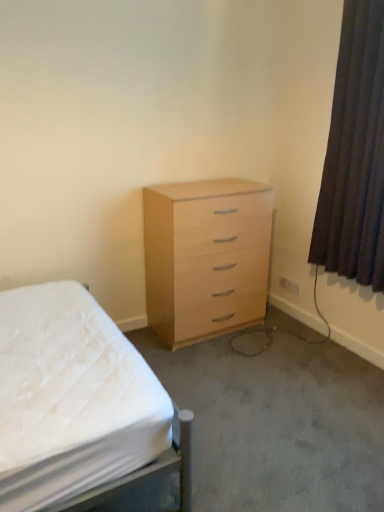
Question: From the image's perspective, is light wood/veneer chest of drawers at center under dark brown fabric curtain at right?

Choices:
 (A) yes
 (B) no

Answer: (A)

Question: Does light wood/veneer chest of drawers at center turn towards dark brown fabric curtain at right?

Choices:
 (A) yes
 (B) no

Answer: (B)

Question: Is light wood/veneer chest of drawers at center positioned in front of dark brown fabric curtain at right?

Choices:
 (A) yes
 (B) no

Answer: (B)

Question: From a real-world perspective, does light wood/veneer chest of drawers at center stand above dark brown fabric curtain at right?

Choices:
 (A) no
 (B) yes

Answer: (A)

Question: Can you confirm if light wood/veneer chest of drawers at center is positioned to the right of dark brown fabric curtain at right?

Choices:
 (A) yes
 (B) no

Answer: (B)

Question: From the image's perspective, is light wood/veneer chest of drawers at center positioned above or below dark brown fabric curtain at right?

Choices:
 (A) above
 (B) below

Answer: (B)

Question: In the image, is light wood/veneer chest of drawers at center on the left side or the right side of dark brown fabric curtain at right?

Choices:
 (A) right
 (B) left

Answer: (B)

Question: Is light wood/veneer chest of drawers at center inside or outside of dark brown fabric curtain at right?

Choices:
 (A) inside
 (B) outside

Answer: (B)

Question: Looking at the image, does light wood/veneer chest of drawers at center seem bigger or smaller compared to dark brown fabric curtain at right?

Choices:
 (A) big
 (B) small

Answer: (A)

Question: In terms of size, does light wood/veneer chest of drawers at center appear bigger or smaller than white fabric bed at center?

Choices:
 (A) big
 (B) small

Answer: (B)

Question: From a real-world perspective, is light wood/veneer chest of drawers at center physically located above or below white fabric bed at center?

Choices:
 (A) below
 (B) above

Answer: (B)

Question: Visually, is light wood/veneer chest of drawers at center positioned to the left or to the right of white fabric bed at center?

Choices:
 (A) left
 (B) right

Answer: (B)

Question: Relative to white fabric bed at center, is light wood/veneer chest of drawers at center in front or behind?

Choices:
 (A) behind
 (B) front

Answer: (A)

Question: Is white fabric bed at center bigger or smaller than dark brown fabric curtain at right?

Choices:
 (A) small
 (B) big

Answer: (B)

Question: From the image's perspective, is white fabric bed at center positioned above or below dark brown fabric curtain at right?

Choices:
 (A) below
 (B) above

Answer: (A)